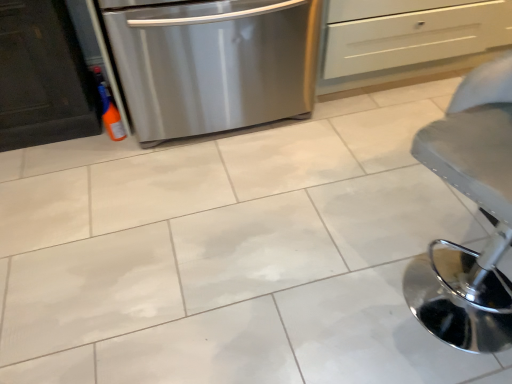
Where is `stainless steel dishwasher at left`? Image resolution: width=512 pixels, height=384 pixels. stainless steel dishwasher at left is located at coordinates (214, 64).

Where is `stainless steel dishwasher at left`? The height and width of the screenshot is (384, 512). stainless steel dishwasher at left is located at coordinates (214, 64).

In the scene shown: Between stainless steel dishwasher at left and white matte drawer at upper center, which one has less height?

white matte drawer at upper center.

From the image's perspective, is stainless steel dishwasher at left located above or below white matte drawer at upper center?

Clearly, from the image's perspective, stainless steel dishwasher at left is below white matte drawer at upper center.

From a real-world perspective, is stainless steel dishwasher at left above or below white matte drawer at upper center?

From a real-world perspective, stainless steel dishwasher at left is physically above white matte drawer at upper center.

Consider the image. Is stainless steel dishwasher at left facing away from white matte drawer at upper center?

That's not correct — stainless steel dishwasher at left is not looking away from white matte drawer at upper center.

From the image's perspective, does metallic gray stool at lower right appear lower than stainless steel dishwasher at left?

Yes.

Who is more distant, metallic gray stool at lower right or stainless steel dishwasher at left?

stainless steel dishwasher at left is further away from the camera.

In the image, there is a stainless steel dishwasher at left. Find the location of `furniture below it (from the image's perspective)`. furniture below it (from the image's perspective) is located at coordinates (477, 203).

Does metallic gray stool at lower right have a greater width compared to stainless steel dishwasher at left?

No, metallic gray stool at lower right is not wider than stainless steel dishwasher at left.

Is metallic gray stool at lower right far away from white matte drawer at upper center?

Absolutely, metallic gray stool at lower right is distant from white matte drawer at upper center.

Is metallic gray stool at lower right oriented towards white matte drawer at upper center?

No, metallic gray stool at lower right is not oriented towards white matte drawer at upper center.

Which is in front, metallic gray stool at lower right or white matte drawer at upper center?

metallic gray stool at lower right is in front.

From a real-world perspective, between white matte drawer at upper center and stainless steel dishwasher at left, who is vertically lower?

white matte drawer at upper center.

How many degrees apart are the facing directions of white matte drawer at upper center and stainless steel dishwasher at left?

They differ by 0.453 degrees in their facing directions.

Is white matte drawer at upper center facing away from stainless steel dishwasher at left?

white matte drawer at upper center does not have its back to stainless steel dishwasher at left.

Find the location of a particular element. The width and height of the screenshot is (512, 384). home appliance above the white matte drawer at upper center (from a real-world perspective) is located at coordinates 214,64.

Is stainless steel dishwasher at left turned away from metallic gray stool at lower right?

stainless steel dishwasher at left is not turned away from metallic gray stool at lower right.

From the image's perspective, which is above, stainless steel dishwasher at left or metallic gray stool at lower right?

stainless steel dishwasher at left appears higher in the image.

Where is `furniture in front of the stainless steel dishwasher at left`? Image resolution: width=512 pixels, height=384 pixels. furniture in front of the stainless steel dishwasher at left is located at coordinates (477, 203).

Is stainless steel dishwasher at left to the left of metallic gray stool at lower right from the viewer's perspective?

Yes, stainless steel dishwasher at left is to the left of metallic gray stool at lower right.

Is white matte drawer at upper center far from metallic gray stool at lower right?

That's right, there is a large distance between white matte drawer at upper center and metallic gray stool at lower right.

Does white matte drawer at upper center have a larger size compared to metallic gray stool at lower right?

Yes.

Is white matte drawer at upper center further to the viewer compared to metallic gray stool at lower right?

Yes.

Does white matte drawer at upper center turn towards metallic gray stool at lower right?

Yes.

Locate an element on the screen. The image size is (512, 384). drawer directly beneath the stainless steel dishwasher at left (from a real-world perspective) is located at coordinates (415, 37).

There is a stainless steel dishwasher at left. In order to click on furniture above it (from a real-world perspective) in this screenshot , I will do `click(477, 203)`.

Which object lies further to the anchor point white matte drawer at upper center, stainless steel dishwasher at left or metallic gray stool at lower right?

metallic gray stool at lower right.

Based on their spatial positions, is white matte drawer at upper center or stainless steel dishwasher at left closer to metallic gray stool at lower right?

stainless steel dishwasher at left.

Which object lies nearer to the anchor point stainless steel dishwasher at left, metallic gray stool at lower right or white matte drawer at upper center?

white matte drawer at upper center is positioned closer to the anchor stainless steel dishwasher at left.

Based on their spatial positions, is metallic gray stool at lower right or stainless steel dishwasher at left closer to white matte drawer at upper center?

Based on the image, stainless steel dishwasher at left appears to be nearer to white matte drawer at upper center.

Estimate the real-world distances between objects in this image. Which object is further from stainless steel dishwasher at left, white matte drawer at upper center or metallic gray stool at lower right?

The object further to stainless steel dishwasher at left is metallic gray stool at lower right.

Looking at the image, which one is located closer to metallic gray stool at lower right, stainless steel dishwasher at left or white matte drawer at upper center?

stainless steel dishwasher at left is closer to metallic gray stool at lower right.

This screenshot has width=512, height=384. I want to click on home appliance between metallic gray stool at lower right and white matte drawer at upper center along the z-axis, so click(214, 64).